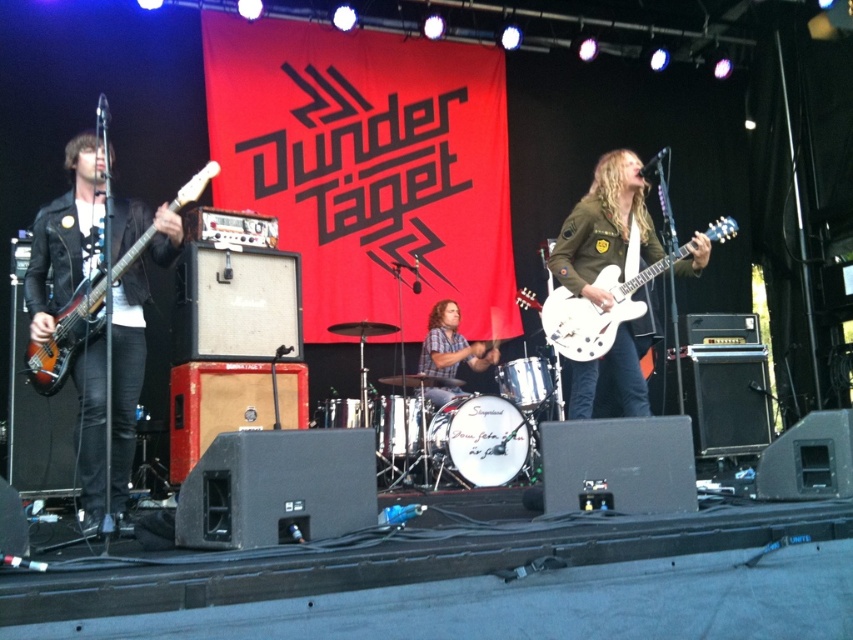
Question: Which object appears closest to the camera in this image?

Choices:
 (A) white glossy electric guitar at center
 (B) wooden drum set at center

Answer: (A)

Question: Considering the relative positions of matte brown electric guitar at left and wooden drum set at center in the image provided, where is matte brown electric guitar at left located with respect to wooden drum set at center?

Choices:
 (A) above
 (B) below

Answer: (A)

Question: Can you confirm if white glossy electric guitar at center is positioned below wooden drum set at center?

Choices:
 (A) no
 (B) yes

Answer: (A)

Question: Which of the following is the farthest from the observer?

Choices:
 (A) (171, 202)
 (B) (480, 342)

Answer: (B)

Question: Can you confirm if white glossy electric guitar at center is wider than matte brown electric guitar at left?

Choices:
 (A) no
 (B) yes

Answer: (B)

Question: Which object is closer to the camera taking this photo?

Choices:
 (A) matte brown electric guitar at left
 (B) wooden drum set at center
 (C) white glossy electric guitar at center

Answer: (A)